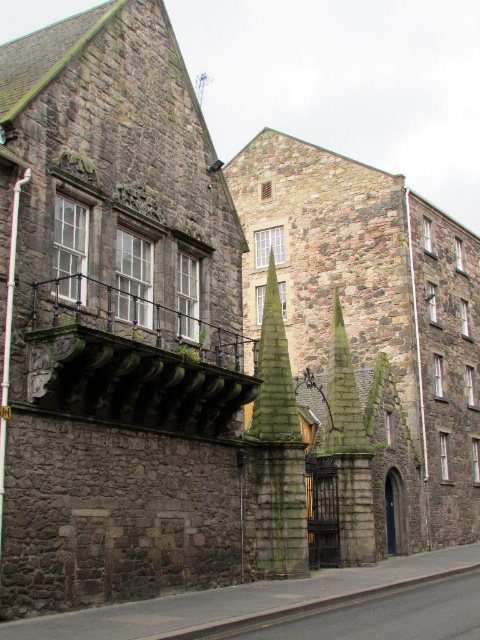
Does smooth stone spire at center appear on the right side of dark gray stone spire at center?

No, smooth stone spire at center is not to the right of dark gray stone spire at center.

The image size is (480, 640). I want to click on smooth stone spire at center, so click(276, 452).